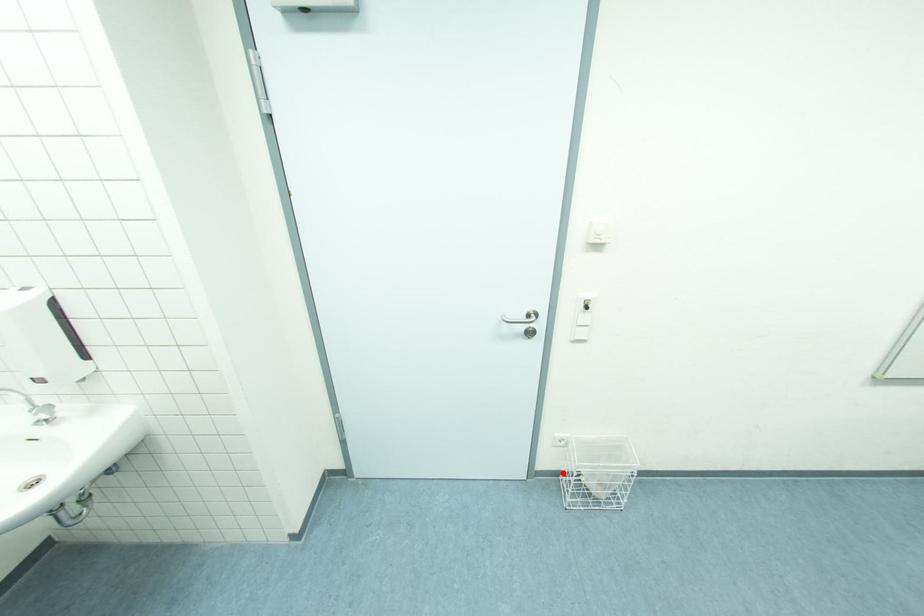
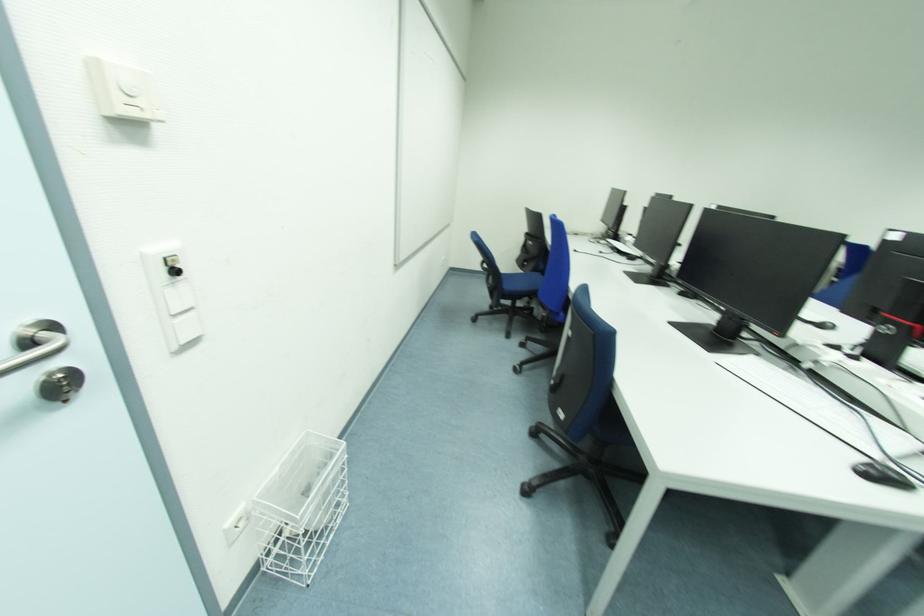
Question: I am providing you with two images of the same scene from different viewpoints. A red point is shown in image1. For the corresponding object point in image2, is it positioned nearer or farther from the camera?

Choices:
 (A) Nearer
 (B) Farther

Answer: (A)